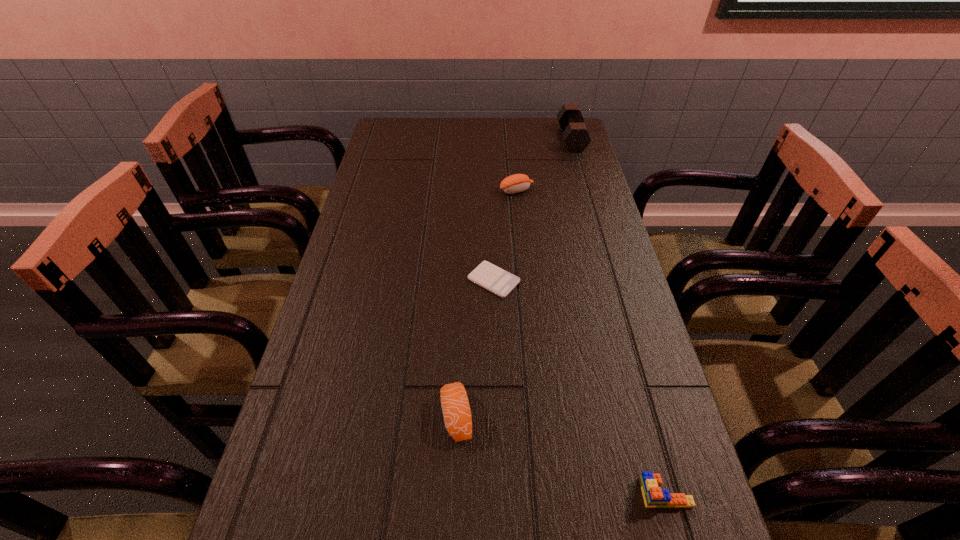
Locate an element on the screen. vacant region located 0.380m on the back of the farther sushi is located at coordinates click(x=511, y=127).

You are a GUI agent. You are given a task and a screenshot of the screen. Output one action in this format:
    pyautogui.click(x=<x>, y=<y>)
    Task: Click on the vacant region located 0.140m on the back of the nearest object
    This screenshot has height=540, width=960.
    Given the screenshot: What is the action you would take?
    coord(641,405)

You are a GUI agent. You are given a task and a screenshot of the screen. Output one action in this format:
    pyautogui.click(x=<x>, y=<y>)
    Task: Click on the free space located 0.150m on the front of the nearer sushi
    The width and height of the screenshot is (960, 540).
    Given the screenshot: What is the action you would take?
    pyautogui.click(x=452, y=538)

Find the location of a particular element. vacant region located on the front of the shortest object is located at coordinates (497, 395).

You are a GUI agent. You are given a task and a screenshot of the screen. Output one action in this format:
    pyautogui.click(x=<x>, y=<y>)
    Task: Click on the object that is at the far edge
    This screenshot has height=540, width=960.
    Given the screenshot: What is the action you would take?
    pyautogui.click(x=575, y=135)

Find the location of a particular element. dumbbell that is positioned at the right edge is located at coordinates (575, 135).

Locate an element on the screen. The height and width of the screenshot is (540, 960). Lego present at the right edge is located at coordinates coord(654,497).

Locate an element on the screen. object that is positioned at the far right corner is located at coordinates (575, 135).

I want to click on vacant space at the far edge, so click(x=478, y=118).

This screenshot has height=540, width=960. Identify the location of vacant point at the left edge. (329, 339).